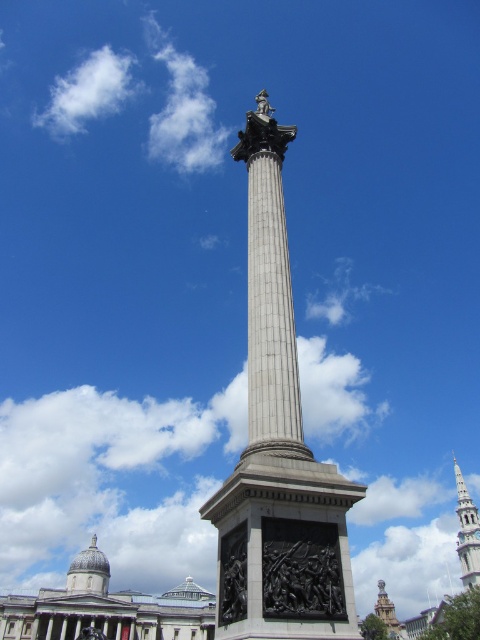
Can you confirm if black polished bronze bas-relief at center is positioned to the left of white fluffy cloud at upper left?

No, black polished bronze bas-relief at center is not to the left of white fluffy cloud at upper left.

Is black polished bronze bas-relief at center behind white fluffy cloud at upper left?

No, black polished bronze bas-relief at center is closer to the viewer.

Identify the location of black polished bronze bas-relief at center. (300, 570).

Is polished bronze statue at center thinner than black polished bronze bas-relief at center?

Incorrect, polished bronze statue at center's width is not less than black polished bronze bas-relief at center's.

Between polished bronze statue at center and black polished bronze bas-relief at center, which one has more height?

polished bronze statue at center

Is point (250, 468) closer to viewer compared to point (295, 538)?

No, (250, 468) is behind (295, 538).

This screenshot has height=640, width=480. What are the coordinates of `polished bronze statue at center` in the screenshot? It's located at (277, 448).

Can you confirm if black polished bronze bas-relief at center is positioned to the left of gold textured tower at center?

Correct, you'll find black polished bronze bas-relief at center to the left of gold textured tower at center.

Describe the element at coordinates (300, 570) in the screenshot. I see `black polished bronze bas-relief at center` at that location.

Is point (313, 577) closer to camera compared to point (407, 637)?

That is True.

The image size is (480, 640). I want to click on black polished bronze bas-relief at center, so click(x=300, y=570).